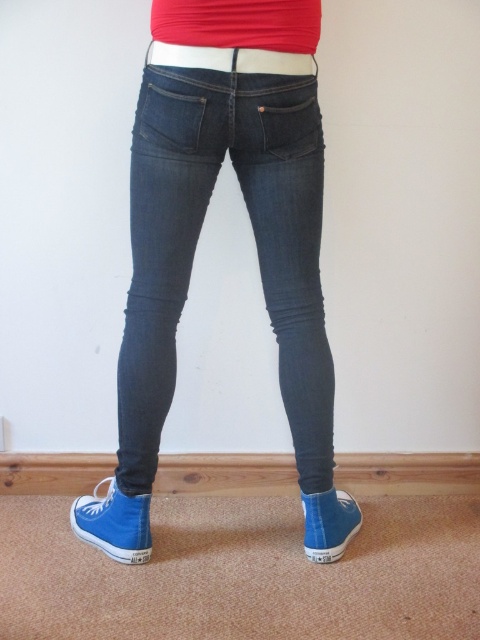
You are trying to decide whether to wear the dark blue denim jeans at center with the white fabric belt at center. Based on their sizes, will the belt fit comfortably around the jeans?

The dark blue denim jeans at center has a larger size compared to the white fabric belt at center, so the belt should fit comfortably around the jeans as it is smaller in size.

You are trying to decide if the white fabric belt at center can fit around the dark blue denim jeans at center. Based on their widths, will the belt be able to fasten properly?

The dark blue denim jeans at center are wider than the white fabric belt at center, so the belt may not fasten properly around the jeans due to the difference in width.